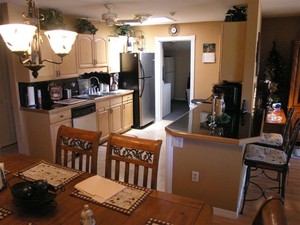
I want to click on table, so click(x=175, y=203).